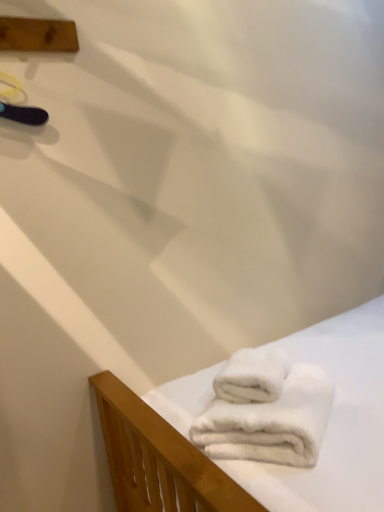
This screenshot has height=512, width=384. I want to click on white fluffy towels at lower right, positioned as the second towel in top-to-bottom order, so click(x=270, y=423).

The width and height of the screenshot is (384, 512). What do you see at coordinates (270, 423) in the screenshot?
I see `white fluffy towels at lower right, which ranks as the first towel in bottom-to-top order` at bounding box center [270, 423].

What do you see at coordinates (252, 376) in the screenshot? This screenshot has width=384, height=512. I see `white fluffy towel at lower right, acting as the second towel starting from the bottom` at bounding box center [252, 376].

I want to click on white fluffy towels at lower right, which ranks as the first towel in bottom-to-top order, so click(x=270, y=423).

Is white fluffy towel at lower right, acting as the second towel starting from the bottom, wider or thinner than wooden plank at upper left?

In the image, white fluffy towel at lower right, acting as the second towel starting from the bottom, appears to be wider than wooden plank at upper left.

Relative to wooden plank at upper left, is white fluffy towel at lower right, acting as the second towel starting from the bottom, in front or behind?

Visually, white fluffy towel at lower right, acting as the second towel starting from the bottom, is located in front of wooden plank at upper left.

Which point is more forward, (276, 389) or (6, 48)?

Positioned in front is point (276, 389).

Is white fluffy towels at lower right, positioned as the second towel in top-to-bottom order, touching wooden plank at upper left?

There is a gap between white fluffy towels at lower right, positioned as the second towel in top-to-bottom order, and wooden plank at upper left.

From a real-world perspective, is white fluffy towels at lower right, positioned as the second towel in top-to-bottom order, physically above wooden plank at upper left?

No, from a real-world perspective, white fluffy towels at lower right, positioned as the second towel in top-to-bottom order, is not over wooden plank at upper left

Does white fluffy towels at lower right, positioned as the second towel in top-to-bottom order, have a greater width compared to wooden plank at upper left?

Indeed, white fluffy towels at lower right, positioned as the second towel in top-to-bottom order, has a greater width compared to wooden plank at upper left.

Which point is more forward, (267, 455) or (64, 35)?

Positioned in front is point (267, 455).

Looking at this image, from a real-world perspective, is white fluffy towels at lower right, positioned as the second towel in top-to-bottom order, physically above white fluffy towel at lower right, which is the 1th towel from top to bottom?

No.

How many degrees apart are the facing directions of white fluffy towels at lower right, which ranks as the first towel in bottom-to-top order, and white fluffy towel at lower right, which is the 1th towel from top to bottom?

white fluffy towels at lower right, which ranks as the first towel in bottom-to-top order, and white fluffy towel at lower right, which is the 1th towel from top to bottom, are facing 0.0511 degrees away from each other.

Measure the distance from white fluffy towels at lower right, which ranks as the first towel in bottom-to-top order, to white fluffy towel at lower right, which is the 1th towel from top to bottom.

3.57 inches.

Which of these two, white fluffy towels at lower right, which ranks as the first towel in bottom-to-top order, or white fluffy towel at lower right, acting as the second towel starting from the bottom, is bigger?

With larger size is white fluffy towels at lower right, which ranks as the first towel in bottom-to-top order.

Considering the relative positions of white fluffy towel at lower right, which is the 1th towel from top to bottom, and white fluffy towels at lower right, which ranks as the first towel in bottom-to-top order, in the image provided, is white fluffy towel at lower right, which is the 1th towel from top to bottom, in front of white fluffy towels at lower right, which ranks as the first towel in bottom-to-top order,?

No, it is not.

What's the angular difference between white fluffy towel at lower right, which is the 1th towel from top to bottom, and white fluffy towels at lower right, which ranks as the first towel in bottom-to-top order,'s facing directions?

The facing directions of white fluffy towel at lower right, which is the 1th towel from top to bottom, and white fluffy towels at lower right, which ranks as the first towel in bottom-to-top order, are 0.0511 degrees apart.

Considering the positions of objects white fluffy towel at lower right, acting as the second towel starting from the bottom, and white fluffy towels at lower right, which ranks as the first towel in bottom-to-top order, in the image provided, who is more to the right, white fluffy towel at lower right, acting as the second towel starting from the bottom, or white fluffy towels at lower right, which ranks as the first towel in bottom-to-top order,?

white fluffy towels at lower right, which ranks as the first towel in bottom-to-top order, is more to the right.

From the image's perspective, is white fluffy towel at lower right, acting as the second towel starting from the bottom, below white fluffy towels at lower right, positioned as the second towel in top-to-bottom order?

No, from the image's perspective, white fluffy towel at lower right, acting as the second towel starting from the bottom, is not beneath white fluffy towels at lower right, positioned as the second towel in top-to-bottom order.

Is wooden plank at upper left not inside white fluffy towel at lower right, acting as the second towel starting from the bottom?

wooden plank at upper left lies outside white fluffy towel at lower right, acting as the second towel starting from the bottom,'s area.

From a real-world perspective, which object stands above the other?

In real-world perspective, wooden plank at upper left is above.

Measure the distance between wooden plank at upper left and white fluffy towel at lower right, acting as the second towel starting from the bottom.

3.50 feet.

Between wooden plank at upper left and white fluffy towel at lower right, acting as the second towel starting from the bottom, which one has smaller size?

wooden plank at upper left.

Which point is more forward, (x=3, y=34) or (x=207, y=437)?

Point (x=207, y=437)

From a real-world perspective, who is located higher, wooden plank at upper left or white fluffy towels at lower right, which ranks as the first towel in bottom-to-top order?

From a 3D spatial view, wooden plank at upper left is above.

You are a GUI agent. You are given a task and a screenshot of the screen. Output one action in this format:
    pyautogui.click(x=<x>, y=<y>)
    Task: Click on the 2nd towel counting from the right of the wooden plank at upper left
    
    Given the screenshot: What is the action you would take?
    pyautogui.click(x=270, y=423)

I want to click on plank located above the white fluffy towel at lower right, which is the 1th towel from top to bottom (from a real-world perspective), so click(x=38, y=35).

The height and width of the screenshot is (512, 384). There is a wooden plank at upper left. In order to click on the 2nd towel below it (from the image's perspective) in this screenshot , I will do `click(270, 423)`.

From the image, which object appears to be farther from white fluffy towel at lower right, which is the 1th towel from top to bottom, wooden plank at upper left or white fluffy towels at lower right, which ranks as the first towel in bottom-to-top order?

wooden plank at upper left.

Which object lies further to the anchor point white fluffy towel at lower right, acting as the second towel starting from the bottom, white fluffy towels at lower right, positioned as the second towel in top-to-bottom order, or wooden plank at upper left?

The object further to white fluffy towel at lower right, acting as the second towel starting from the bottom, is wooden plank at upper left.

Estimate the real-world distances between objects in this image. Which object is further from white fluffy towels at lower right, which ranks as the first towel in bottom-to-top order, white fluffy towel at lower right, acting as the second towel starting from the bottom, or wooden plank at upper left?

wooden plank at upper left.

When comparing their distances from wooden plank at upper left, does white fluffy towel at lower right, acting as the second towel starting from the bottom, or white fluffy towels at lower right, which ranks as the first towel in bottom-to-top order, seem further?

The object further to wooden plank at upper left is white fluffy towels at lower right, which ranks as the first towel in bottom-to-top order.

Based on their spatial positions, is white fluffy towels at lower right, positioned as the second towel in top-to-bottom order, or white fluffy towel at lower right, acting as the second towel starting from the bottom, further from wooden plank at upper left?

The object further to wooden plank at upper left is white fluffy towels at lower right, positioned as the second towel in top-to-bottom order.

When comparing their distances from white fluffy towels at lower right, positioned as the second towel in top-to-bottom order, does wooden plank at upper left or white fluffy towel at lower right, acting as the second towel starting from the bottom, seem further?

Among the two, wooden plank at upper left is located further to white fluffy towels at lower right, positioned as the second towel in top-to-bottom order.

Where is `towel between wooden plank at upper left and white fluffy towels at lower right, which ranks as the first towel in bottom-to-top order, from top to bottom`? towel between wooden plank at upper left and white fluffy towels at lower right, which ranks as the first towel in bottom-to-top order, from top to bottom is located at coordinates (252, 376).